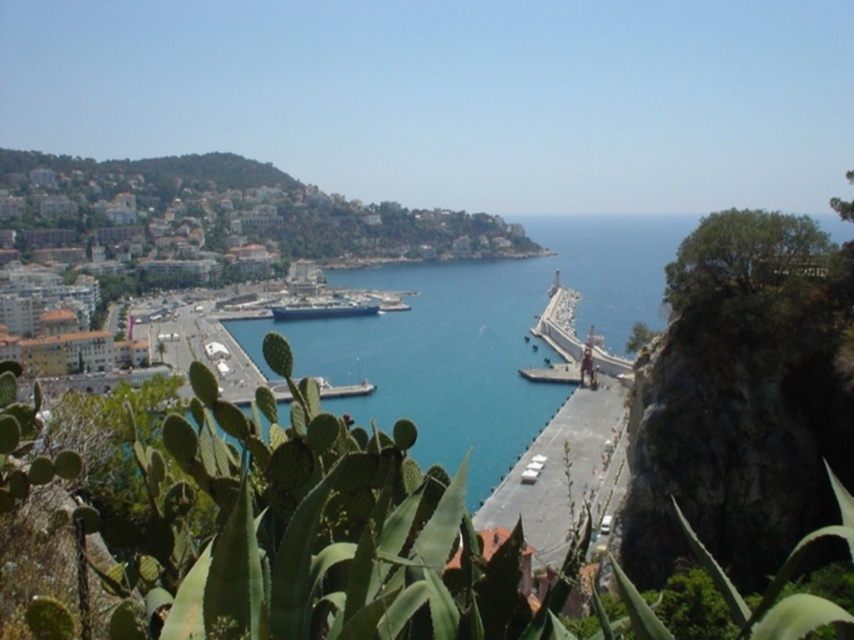
In the scene shown: You are standing at the edge of the pier and want to take a photo of the blue metallic cruise ship at center without the green spiny cactus at lower left blocking it. Where should you move to achieve this?

The green spiny cactus at lower left is in front of the blue metallic cruise ship at center. To avoid the cactus blocking the view, you should move to a position where the cruise ship is no longer behind the cactus, such as moving to the right side of the pier or adjusting your angle so that the cactus is out of frame.

Based on the scene description, where is the green spiny cactus at lower left located in terms of coordinates?

A: The green spiny cactus at lower left is located at coordinates point (311, 536).

You are standing at the edge of the pier and see the blue water at center and the blue metallic cruise ship at center. Which one appears nearer to you?

The blue water at center appears nearer to you because it is closer to the viewer than the blue metallic cruise ship at center.